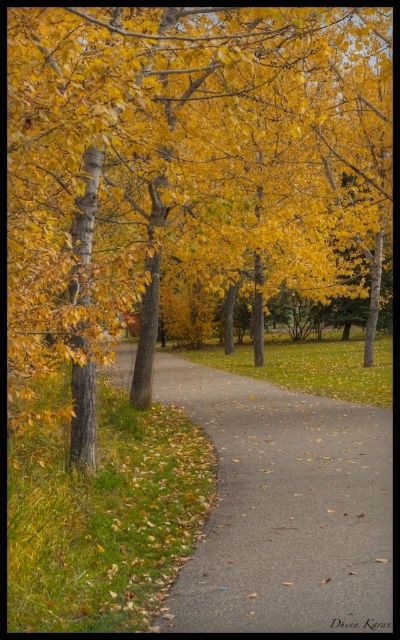
Who is taller, golden yellow leaves at center or brown asphalt path at left?

golden yellow leaves at center is taller.

Is point (106, 324) less distant than point (250, 541)?

That is False.

You are a GUI agent. You are given a task and a screenshot of the screen. Output one action in this format:
    pyautogui.click(x=<x>, y=<y>)
    Task: Click on the golden yellow leaves at center
    
    Given the screenshot: What is the action you would take?
    pyautogui.click(x=185, y=168)